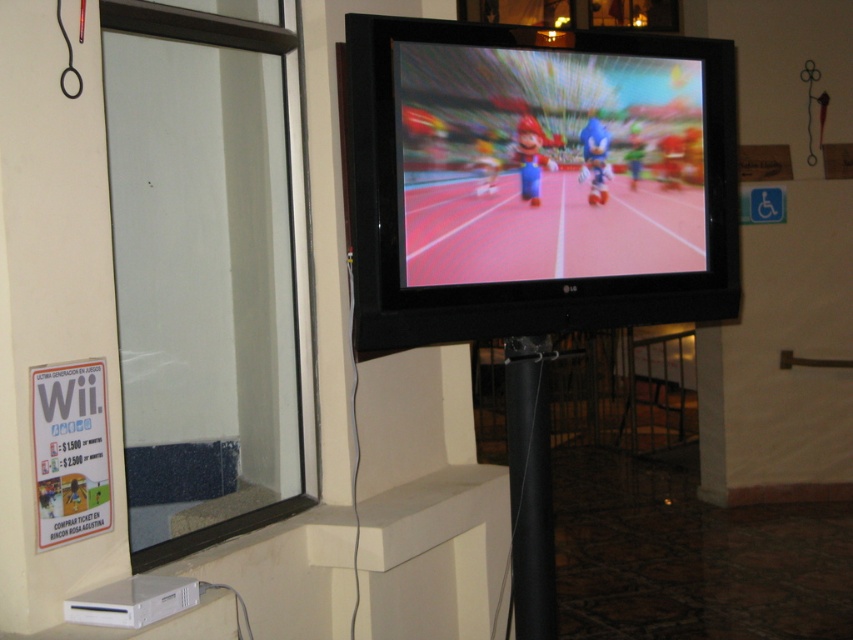
Between matte plastic screen at center and black matte pole at center, which one is positioned lower?

black matte pole at center is below.

Does matte plastic screen at center have a lesser width compared to black matte pole at center?

Incorrect, matte plastic screen at center's width is not less than black matte pole at center's.

Where is `matte plastic screen at center`? This screenshot has width=853, height=640. matte plastic screen at center is located at coordinates (546, 163).